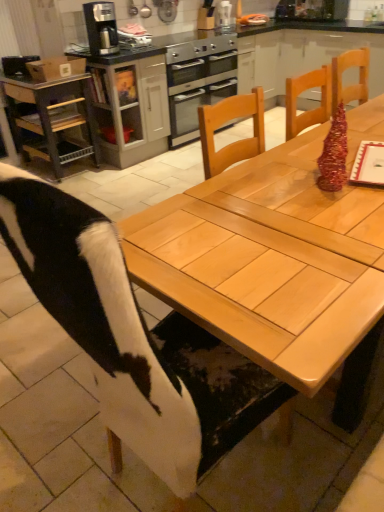
You are a GUI agent. You are given a task and a screenshot of the screen. Output one action in this format:
    pyautogui.click(x=<x>, y=<y>)
    Task: Click on the vacant area to the right of cowhide at center
    
    Given the screenshot: What is the action you would take?
    pyautogui.click(x=296, y=464)